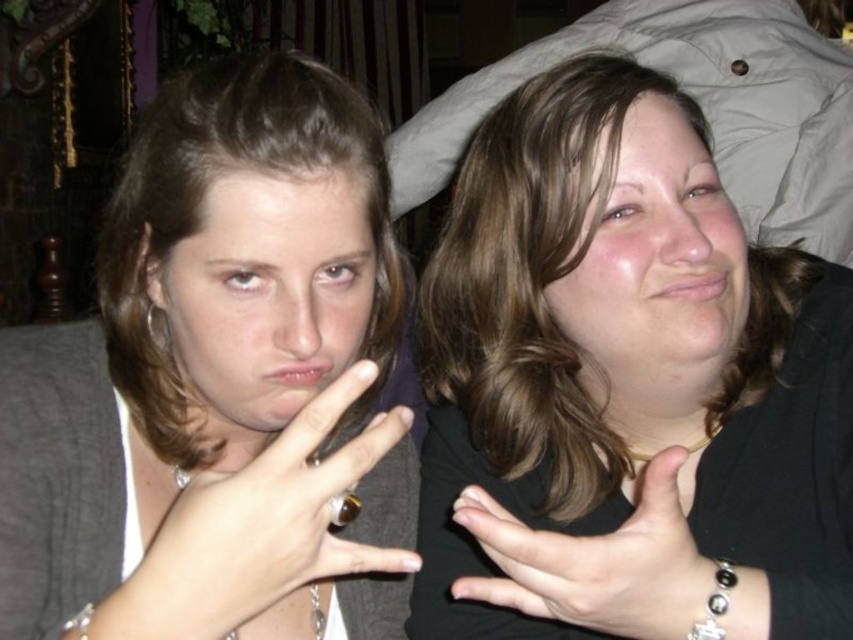
Question: Which point is closer to the camera?

Choices:
 (A) (669, 92)
 (B) (39, 456)
 (C) (368, 460)

Answer: (C)

Question: Which point is farther to the camera?

Choices:
 (A) (152, 316)
 (B) (194, 128)
 (C) (776, 340)

Answer: (C)

Question: Does gold ring at center come in front of silver metallic earring at upper left?

Choices:
 (A) yes
 (B) no

Answer: (A)

Question: Can you confirm if matte black ring at center is wider than silver metallic earring at upper left?

Choices:
 (A) no
 (B) yes

Answer: (B)

Question: Is matte black ring at center smaller than silver metallic earring at upper left?

Choices:
 (A) yes
 (B) no

Answer: (B)

Question: Which object is the closest to the silver metallic earring at upper left?

Choices:
 (A) black matte jacket at upper right
 (B) matte black ring at center
 (C) gold ring at center

Answer: (B)